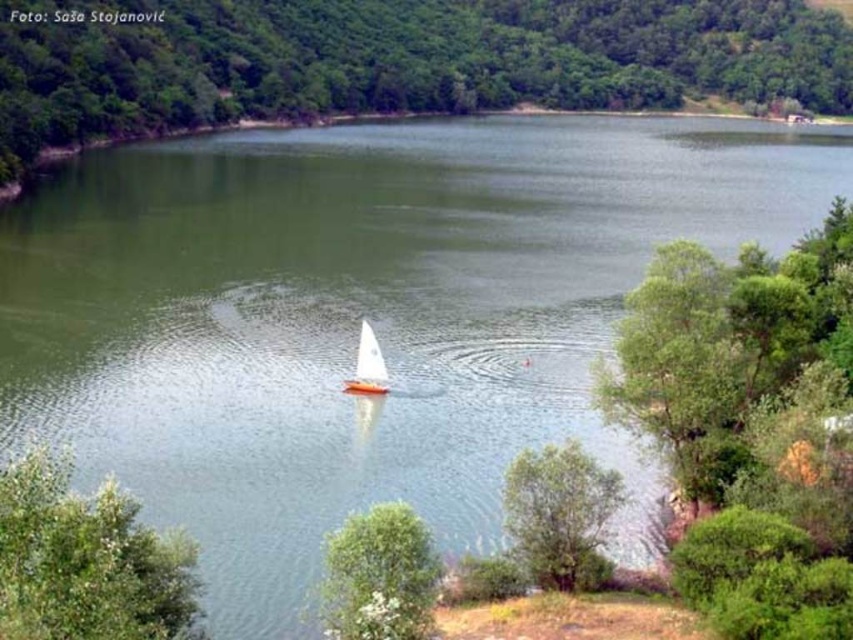
You are standing at the edge of the lakeside and see the green leafy tree at lower center and the green leafy tree at lower right. Which tree is closer to your left side?

The green leafy tree at lower center is positioned on the left side of the green leafy tree at lower right, so it is closer to your left side.

Consider the image. You are standing at the center of the lakeside and want to take a photo that includes both the green leafy tree at lower left and the green leafy tree at lower right. Which tree should you position closer to the edge of the frame to ensure both are fully visible?

You should position the green leafy tree at lower left closer to the edge of the frame because it is bigger than the green leafy tree at lower right, so it requires more space to be fully visible.

You are a bird flying over the lakeside scene. You want to land on the largest tree to rest. Which tree should you choose between the green leafy tree at lower left and the green leafy tree at lower center?

The green leafy tree at lower left is bigger than the green leafy tree at lower center, so you should choose the green leafy tree at lower left to rest.